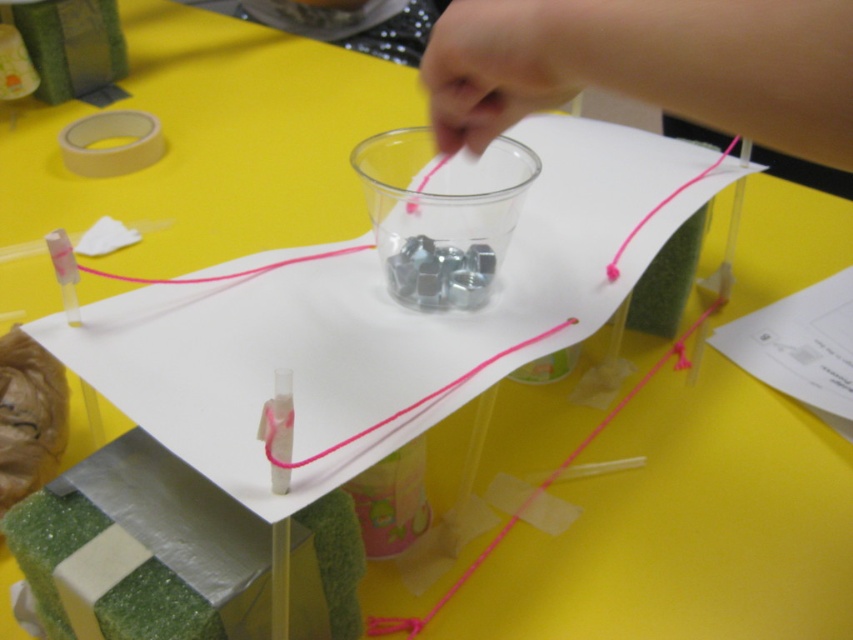
Does white matte tape at upper left have a greater width compared to pink string at center?

In fact, white matte tape at upper left might be narrower than pink string at center.

Does white matte tape at upper left have a smaller size compared to pink string at center?

Yes.

What do you see at coordinates (111, 141) in the screenshot?
I see `white matte tape at upper left` at bounding box center [111, 141].

You are a GUI agent. You are given a task and a screenshot of the screen. Output one action in this format:
    pyautogui.click(x=<x>, y=<y>)
    Task: Click on the white matte tape at upper left
    
    Given the screenshot: What is the action you would take?
    pyautogui.click(x=111, y=141)

Can you confirm if pink fabric hand at upper center is positioned to the left of white matte tape at upper left?

In fact, pink fabric hand at upper center is to the right of white matte tape at upper left.

Does pink fabric hand at upper center have a smaller size compared to white matte tape at upper left?

No.

Where is `pink fabric hand at upper center`? This screenshot has height=640, width=853. pink fabric hand at upper center is located at coordinates click(x=648, y=67).

Locate an element on the screen. pink fabric hand at upper center is located at coordinates (648, 67).

Which is in front, point (492, 100) or point (357, 433)?

Positioned in front is point (357, 433).

The height and width of the screenshot is (640, 853). Describe the element at coordinates (648, 67) in the screenshot. I see `pink fabric hand at upper center` at that location.

Locate an element on the screen. pink fabric hand at upper center is located at coordinates (648, 67).

Identify the location of pink fabric hand at upper center. (648, 67).